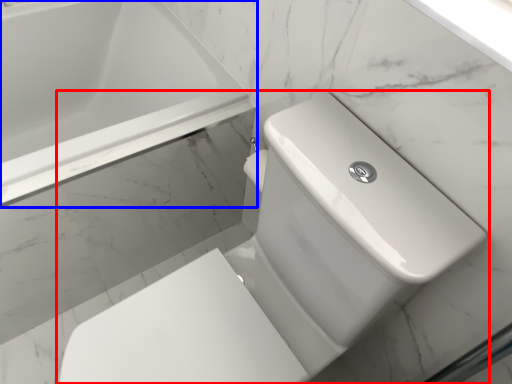
Question: Among these objects, which one is nearest to the camera, toilet (highlighted by a red box) or bathtub (highlighted by a blue box)?

Choices:
 (A) toilet
 (B) bathtub

Answer: (A)